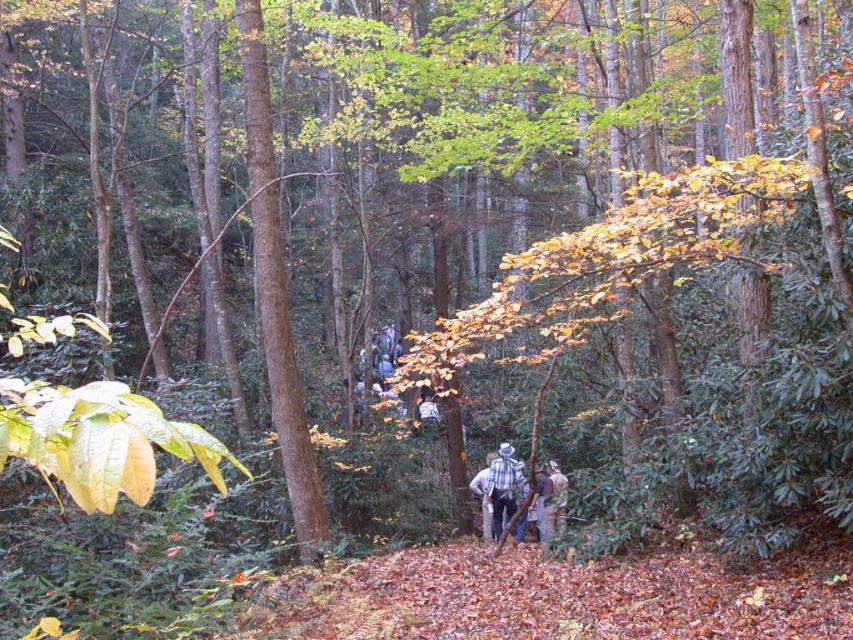
You are a hiker who wants to identify which clothing item is lower on the same person. You see a plaid shirt at center and a plaid flannel shirt at center. Which one is positioned lower?

The plaid shirt at center is positioned lower than the plaid flannel shirt at center.

You are standing on the path in the forest and want to reach a point marked by coordinates. Which of the two points, point (496, 488) or point (521, 476), is closer to you?

Point (496, 488) is closer to the viewer than point (521, 476).

You are a hiker trying to identify two people in the forest. You see a plaid shirt at center and a plaid flannel shirt at center. Which of these two shirts is higher up in the image?

The plaid shirt at center is taller than plaid flannel shirt at center, so the plaid shirt at center is higher up in the image.